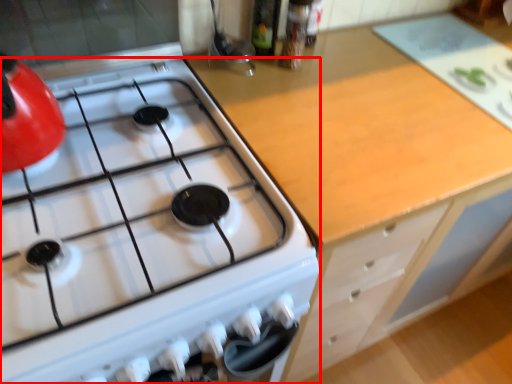
Question: In this image, where is gas stove (annotated by the red box) located relative to cabinetry?

Choices:
 (A) left
 (B) right

Answer: (A)